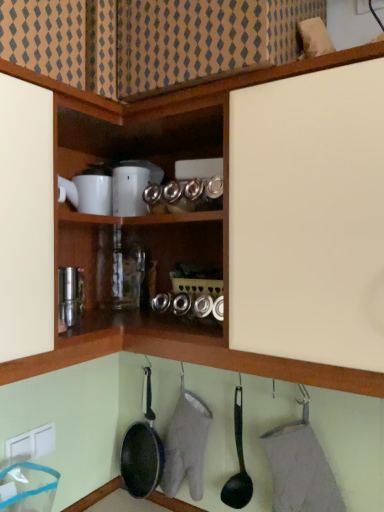
Locate an element on the screen. white plastic electric outlet at lower left is located at coordinates click(x=31, y=443).

In order to face white glossy coffee maker at upper center, should I rotate leftwards or rightwards?

Turn left by 8.152 degrees to look at white glossy coffee maker at upper center.

The image size is (384, 512). I want to click on white glossy coffee maker at upper center, so click(x=129, y=191).

This screenshot has width=384, height=512. Describe the element at coordinates (142, 450) in the screenshot. I see `black non-stick frying pan at lower center, the 2th frying pan viewed from the front` at that location.

Where is `black plastic frying pan at lower center, the second frying pan positioned from the left`? Image resolution: width=384 pixels, height=512 pixels. black plastic frying pan at lower center, the second frying pan positioned from the left is located at coordinates (239, 464).

From a real-world perspective, is black plastic frying pan at lower center, placed as the first frying pan when sorted from right to left, above or below white glossy coffee maker at upper center?

From a real-world perspective, black plastic frying pan at lower center, placed as the first frying pan when sorted from right to left, is physically below white glossy coffee maker at upper center.

Considering the relative sizes of black plastic frying pan at lower center, placed as the first frying pan when sorted from right to left, and white glossy coffee maker at upper center in the image provided, is black plastic frying pan at lower center, placed as the first frying pan when sorted from right to left, shorter than white glossy coffee maker at upper center?

No.

Which object is closer to the camera, black plastic frying pan at lower center, the second frying pan positioned from the left, or white glossy coffee maker at upper center?

black plastic frying pan at lower center, the second frying pan positioned from the left, is in front.

Do you think black non-stick frying pan at lower center, the 2th frying pan viewed from the front, is within black plastic frying pan at lower center, the second frying pan positioned from the left, or outside of it?

black non-stick frying pan at lower center, the 2th frying pan viewed from the front, exists outside the volume of black plastic frying pan at lower center, the second frying pan positioned from the left.

Can you confirm if black non-stick frying pan at lower center, the 2th frying pan viewed from the front, is taller than black plastic frying pan at lower center, placed as the 1th frying pan when sorted from front to back?

Yes, black non-stick frying pan at lower center, the 2th frying pan viewed from the front, is taller than black plastic frying pan at lower center, placed as the 1th frying pan when sorted from front to back.

Find the location of a particular element. Image resolution: width=384 pixels, height=512 pixels. frying pan that is below the black plastic frying pan at lower center, the second frying pan positioned from the left (from the image's perspective) is located at coordinates (142, 450).

Would you say white glossy coffee maker at upper center is outside black non-stick frying pan at lower center, which ranks as the 1th frying pan in left-to-right order?

Yes, white glossy coffee maker at upper center is outside of black non-stick frying pan at lower center, which ranks as the 1th frying pan in left-to-right order.

Which of these two, white glossy coffee maker at upper center or black non-stick frying pan at lower center, which is counted as the first frying pan, starting from the back, is bigger?

Bigger between the two is black non-stick frying pan at lower center, which is counted as the first frying pan, starting from the back.

From the image's perspective, would you say white glossy coffee maker at upper center is positioned over black non-stick frying pan at lower center, arranged as the 2th frying pan when viewed from the right?

Correct, white glossy coffee maker at upper center appears higher than black non-stick frying pan at lower center, arranged as the 2th frying pan when viewed from the right, in the image.

From a real-world perspective, is white glossy coffee maker at upper center physically located above or below black non-stick frying pan at lower center, which ranks as the 1th frying pan in left-to-right order?

Clearly, from a real-world perspective, white glossy coffee maker at upper center is above black non-stick frying pan at lower center, which ranks as the 1th frying pan in left-to-right order.

The height and width of the screenshot is (512, 384). Find the location of `frying pan that appears below the black plastic frying pan at lower center, placed as the first frying pan when sorted from right to left (from the image's perspective)`. frying pan that appears below the black plastic frying pan at lower center, placed as the first frying pan when sorted from right to left (from the image's perspective) is located at coordinates (142, 450).

Can you tell me how much black plastic frying pan at lower center, which appears as the 2th frying pan when viewed from the back, and black non-stick frying pan at lower center, the 2th frying pan viewed from the front, differ in facing direction?

0.00136 degrees separate the facing orientations of black plastic frying pan at lower center, which appears as the 2th frying pan when viewed from the back, and black non-stick frying pan at lower center, the 2th frying pan viewed from the front.

Can you see black plastic frying pan at lower center, the second frying pan positioned from the left, touching black non-stick frying pan at lower center, which is counted as the first frying pan, starting from the back?

black plastic frying pan at lower center, the second frying pan positioned from the left, and black non-stick frying pan at lower center, which is counted as the first frying pan, starting from the back, are clearly separated.

Does black plastic frying pan at lower center, placed as the 1th frying pan when sorted from front to back, have a larger size compared to black non-stick frying pan at lower center, which is counted as the first frying pan, starting from the back?

No.

Is black non-stick frying pan at lower center, arranged as the 2th frying pan when viewed from the right, positioned with its back to white plastic electric outlet at lower left?

No, black non-stick frying pan at lower center, arranged as the 2th frying pan when viewed from the right, is not facing the opposite direction of white plastic electric outlet at lower left.

How different are the orientations of black non-stick frying pan at lower center, which is counted as the first frying pan, starting from the back, and white plastic electric outlet at lower left in degrees?

The angular difference between black non-stick frying pan at lower center, which is counted as the first frying pan, starting from the back, and white plastic electric outlet at lower left is 87.7 degrees.

Is black non-stick frying pan at lower center, which ranks as the 1th frying pan in left-to-right order, touching white plastic electric outlet at lower left?

No, black non-stick frying pan at lower center, which ranks as the 1th frying pan in left-to-right order, is not beside white plastic electric outlet at lower left.

I want to click on electric outlet in front of the black non-stick frying pan at lower center, arranged as the 2th frying pan when viewed from the right, so click(31, 443).

Is white plastic electric outlet at lower left taller than black non-stick frying pan at lower center, the 2th frying pan viewed from the front?

No, white plastic electric outlet at lower left is not taller than black non-stick frying pan at lower center, the 2th frying pan viewed from the front.

Which is in front, point (42, 441) or point (151, 487)?

Positioned in front is point (42, 441).

Is white plastic electric outlet at lower left far away from black non-stick frying pan at lower center, the 2th frying pan viewed from the front?

white plastic electric outlet at lower left is near black non-stick frying pan at lower center, the 2th frying pan viewed from the front, not far away.

Does white plastic electric outlet at lower left have a lesser width compared to black non-stick frying pan at lower center, the 2th frying pan viewed from the front?

Indeed, white plastic electric outlet at lower left has a lesser width compared to black non-stick frying pan at lower center, the 2th frying pan viewed from the front.

Considering the sizes of objects white glossy coffee maker at upper center and black plastic frying pan at lower center, placed as the 1th frying pan when sorted from front to back, in the image provided, who is shorter, white glossy coffee maker at upper center or black plastic frying pan at lower center, placed as the 1th frying pan when sorted from front to back,?

white glossy coffee maker at upper center.

Is black plastic frying pan at lower center, placed as the 1th frying pan when sorted from front to back, at the back of white glossy coffee maker at upper center?

No.

Which of these two, white glossy coffee maker at upper center or black plastic frying pan at lower center, which appears as the 2th frying pan when viewed from the back, is smaller?

white glossy coffee maker at upper center.

Is white glossy coffee maker at upper center next to black plastic frying pan at lower center, placed as the first frying pan when sorted from right to left?

No.

Identify the location of frying pan located in front of the white glossy coffee maker at upper center. click(239, 464).

Locate an element on the screen. This screenshot has height=512, width=384. frying pan below the black plastic frying pan at lower center, the second frying pan positioned from the left (from a real-world perspective) is located at coordinates (142, 450).

Considering their positions, is black plastic frying pan at lower center, which appears as the 2th frying pan when viewed from the back, positioned closer to white glossy coffee maker at upper center than black non-stick frying pan at lower center, arranged as the 2th frying pan when viewed from the right?

black plastic frying pan at lower center, which appears as the 2th frying pan when viewed from the back.

Considering their positions, is black non-stick frying pan at lower center, the 2th frying pan viewed from the front, positioned closer to white glossy coffee maker at upper center than black plastic frying pan at lower center, the second frying pan positioned from the left?

black plastic frying pan at lower center, the second frying pan positioned from the left.

From the image, which object appears to be nearer to black non-stick frying pan at lower center, which ranks as the 1th frying pan in left-to-right order, white plastic electric outlet at lower left or white glossy coffee maker at upper center?

white plastic electric outlet at lower left is positioned closer to the anchor black non-stick frying pan at lower center, which ranks as the 1th frying pan in left-to-right order.

Which object lies further to the anchor point white plastic electric outlet at lower left, black plastic frying pan at lower center, placed as the 1th frying pan when sorted from front to back, or white glossy coffee maker at upper center?

Based on the image, white glossy coffee maker at upper center appears to be further to white plastic electric outlet at lower left.

Looking at this image, which object lies further to the anchor point white plastic electric outlet at lower left, white glossy coffee maker at upper center or black non-stick frying pan at lower center, which is counted as the first frying pan, starting from the back?

Based on the image, white glossy coffee maker at upper center appears to be further to white plastic electric outlet at lower left.

When comparing their distances from black non-stick frying pan at lower center, which is counted as the first frying pan, starting from the back, does white plastic electric outlet at lower left or black plastic frying pan at lower center, which appears as the 2th frying pan when viewed from the back, seem further?

white plastic electric outlet at lower left is further to black non-stick frying pan at lower center, which is counted as the first frying pan, starting from the back.

Based on their spatial positions, is black plastic frying pan at lower center, placed as the first frying pan when sorted from right to left, or white plastic electric outlet at lower left closer to white glossy coffee maker at upper center?

Among the two, black plastic frying pan at lower center, placed as the first frying pan when sorted from right to left, is located nearer to white glossy coffee maker at upper center.

Based on the photo, considering their positions, is black non-stick frying pan at lower center, which is counted as the first frying pan, starting from the back, positioned closer to white glossy coffee maker at upper center than white plastic electric outlet at lower left?

white plastic electric outlet at lower left is positioned closer to the anchor white glossy coffee maker at upper center.

At what (x,y) coordinates should I click in order to perform the action: click on frying pan between white plastic electric outlet at lower left and black plastic frying pan at lower center, placed as the 1th frying pan when sorted from front to back. Please return your answer as a coordinate pair (x, y). The width and height of the screenshot is (384, 512). Looking at the image, I should click on [142, 450].

I want to click on frying pan between white glossy coffee maker at upper center and black non-stick frying pan at lower center, arranged as the 2th frying pan when viewed from the right, vertically, so click(239, 464).

The height and width of the screenshot is (512, 384). Find the location of `electric outlet between white glossy coffee maker at upper center and black non-stick frying pan at lower center, the 2th frying pan viewed from the front, in the up-down direction`. electric outlet between white glossy coffee maker at upper center and black non-stick frying pan at lower center, the 2th frying pan viewed from the front, in the up-down direction is located at coordinates (31, 443).

The height and width of the screenshot is (512, 384). Identify the location of frying pan between white glossy coffee maker at upper center and white plastic electric outlet at lower left in the vertical direction. (239, 464).